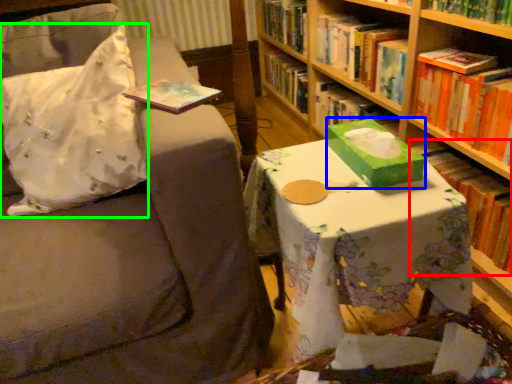
Question: Which is farther away from book (highlighted by a red box)? box (highlighted by a blue box) or throw pillow (highlighted by a green box)?

Choices:
 (A) box
 (B) throw pillow

Answer: (B)